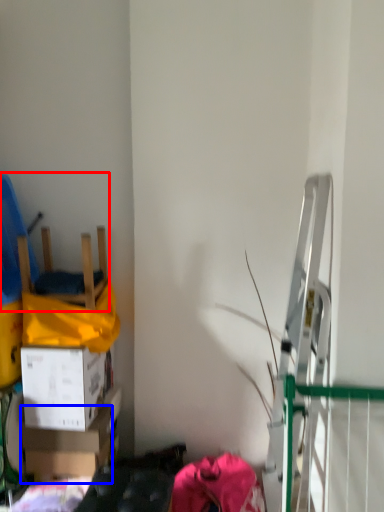
Question: Which object is closer to the camera taking this photo, chair (highlighted by a red box) or box (highlighted by a blue box)?

Choices:
 (A) chair
 (B) box

Answer: (A)